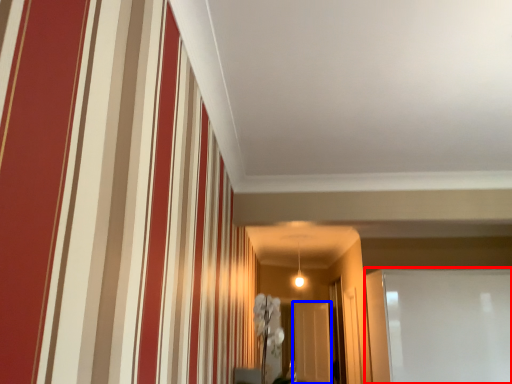
Question: Which of the following is the closest to the observer, glass door (highlighted by a red box) or glass door (highlighted by a blue box)?

Choices:
 (A) glass door
 (B) glass door

Answer: (A)